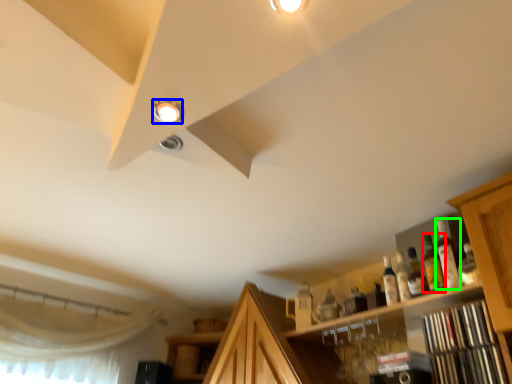
Question: Estimate the real-world distances between objects in this image. Which object is closer to bottle (highlighted by a red box), droplight (highlighted by a blue box) or bottle (highlighted by a green box)?

Choices:
 (A) droplight
 (B) bottle

Answer: (B)